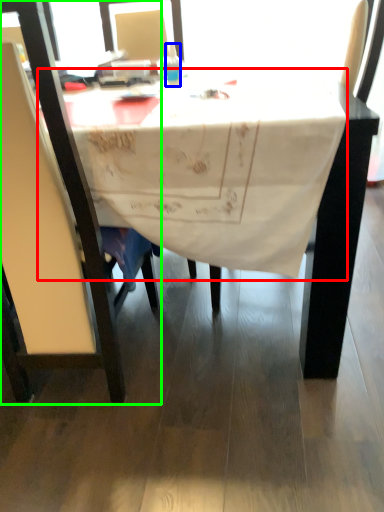
Question: Which is nearer to the tablecloth (highlighted by a red box)? bottle (highlighted by a blue box) or chair (highlighted by a green box).

Choices:
 (A) bottle
 (B) chair

Answer: (B)